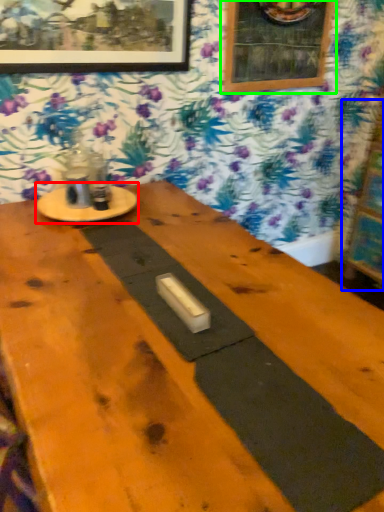
Question: Considering the real-world distances, which object is farthest from round table (highlighted by a red box)? bulletin board (highlighted by a blue box) or picture frame (highlighted by a green box)?

Choices:
 (A) bulletin board
 (B) picture frame

Answer: (A)